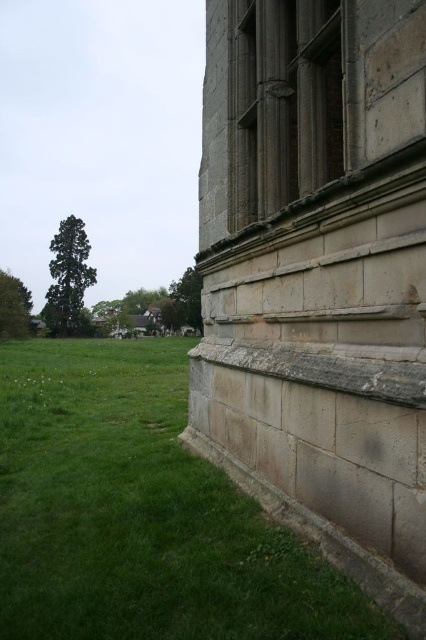
You are standing at the base of the stone building and want to place a 30 feet long ladder to reach the dark gray stone window at upper right from the green grass at lower left. Will the ladder be long enough to reach the window?

The distance between the green grass at lower left and the dark gray stone window at upper right is 28.43 feet. Since the ladder is 30 feet long, it will be long enough to reach the window.

You are standing in front of the stone building and want to take a photo of the dark gray stone window at upper right. To avoid including the green grass at lower left in your photo, should you move to the right or left?

The green grass at lower left is positioned on the left side of the dark gray stone window at upper right. To avoid including the green grass at lower left, you should move to the right side of the dark gray stone window at upper right.